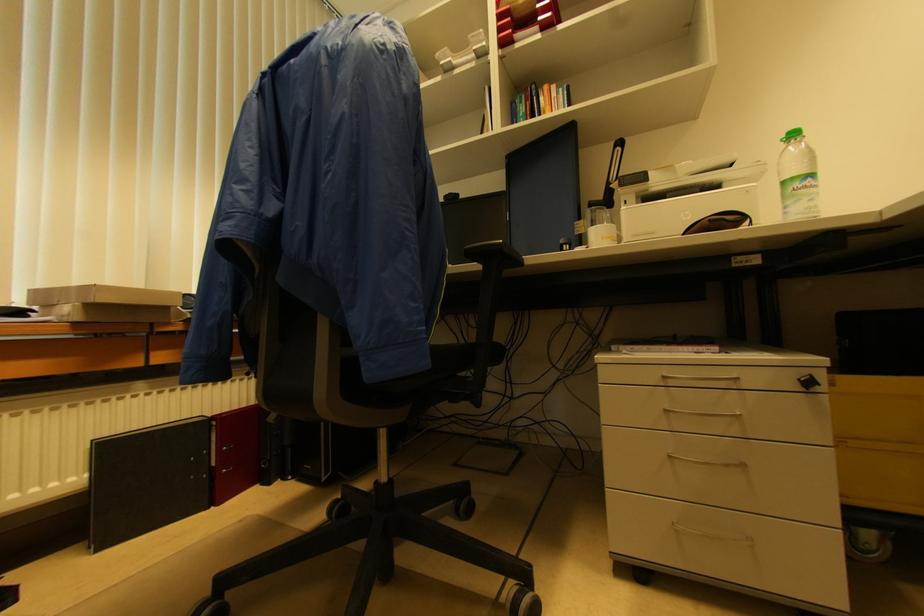
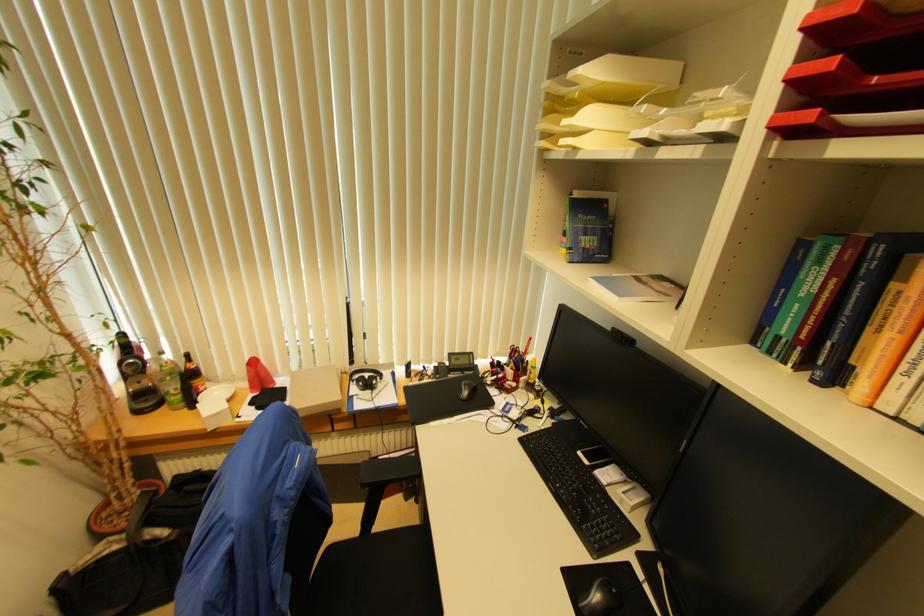
Where in the second image is the point corresponding to [545,114] from the first image?

(881, 333)